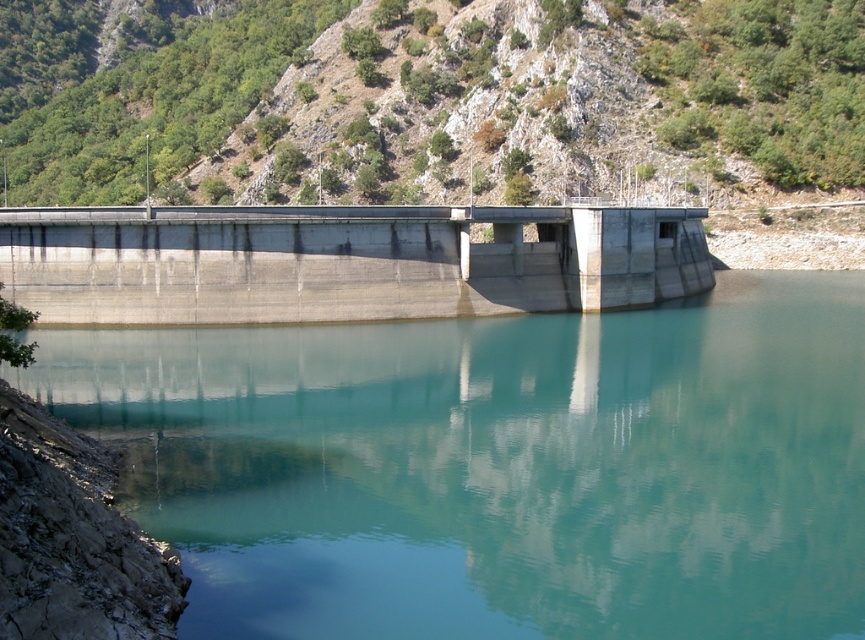
Is green textured hillside at upper center closer to camera compared to gray concrete dam at center?

That is False.

Is green textured hillside at upper center taller than gray concrete dam at center?

Correct, green textured hillside at upper center is much taller as gray concrete dam at center.

What do you see at coordinates (447, 108) in the screenshot?
I see `green textured hillside at upper center` at bounding box center [447, 108].

Locate an element on the screen. green textured hillside at upper center is located at coordinates (447, 108).

I want to click on teal smooth water at center, so click(x=498, y=467).

Between teal smooth water at center and gray concrete dam at center, which one has less height?

teal smooth water at center

Identify the location of teal smooth water at center. Image resolution: width=865 pixels, height=640 pixels. (498, 467).

Identify the location of teal smooth water at center. (498, 467).

Describe the element at coordinates (498, 467) in the screenshot. This screenshot has height=640, width=865. I see `teal smooth water at center` at that location.

This screenshot has width=865, height=640. Find the location of `teal smooth water at center`. teal smooth water at center is located at coordinates (498, 467).

Image resolution: width=865 pixels, height=640 pixels. What do you see at coordinates (498, 467) in the screenshot?
I see `teal smooth water at center` at bounding box center [498, 467].

Where is `teal smooth water at center`? The image size is (865, 640). teal smooth water at center is located at coordinates click(498, 467).